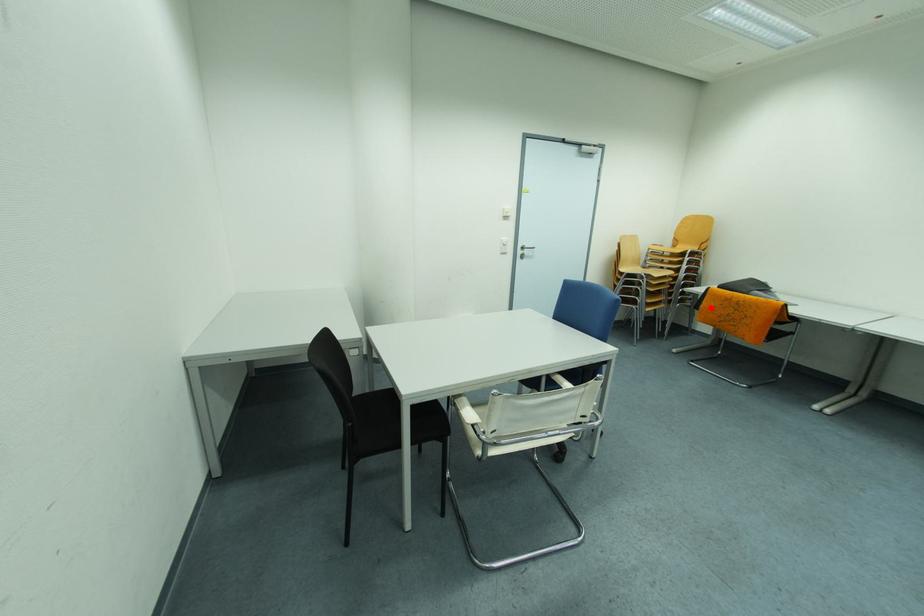
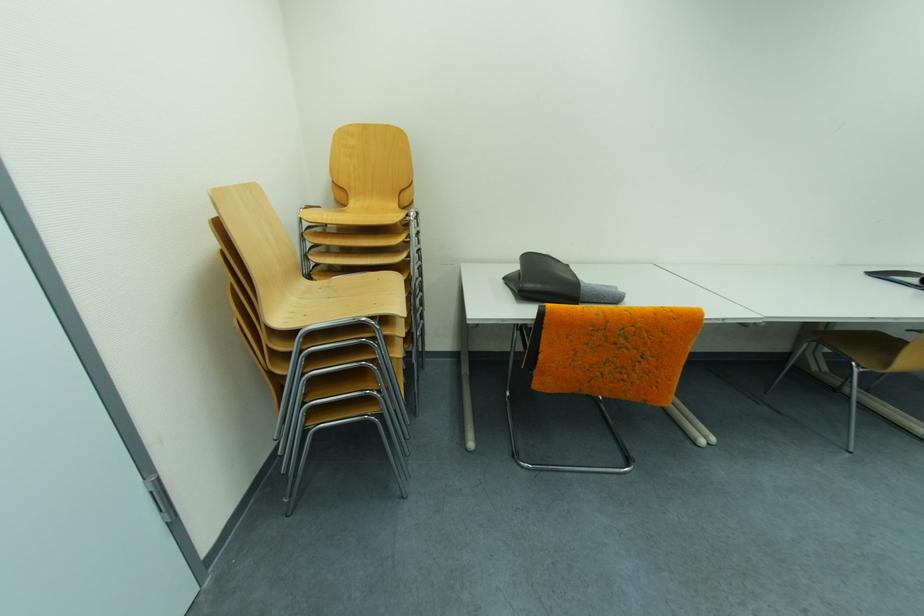
Find the pixel in the second image that matches the highlighted location in the first image.

(549, 359)